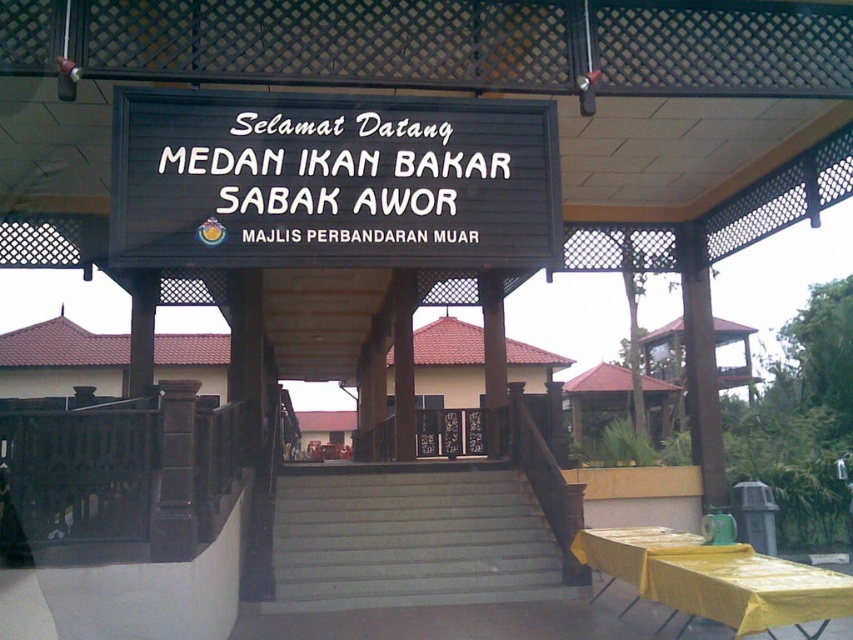
Question: Which object is closer to the camera taking this photo?

Choices:
 (A) black wood sign at center
 (B) yellow plastic table at lower right

Answer: (A)

Question: Is gray concrete stairs at center in front of yellow plastic table at lower right?

Choices:
 (A) yes
 (B) no

Answer: (B)

Question: Which point is farther from the camera taking this photo?

Choices:
 (A) (248, 204)
 (B) (704, 564)
 (C) (323, 579)

Answer: (C)

Question: Which object appears closest to the camera in this image?

Choices:
 (A) yellow plastic table at lower right
 (B) black wood sign at center

Answer: (B)

Question: Is black wood sign at center wider than gray concrete stairs at center?

Choices:
 (A) yes
 (B) no

Answer: (B)

Question: Does black wood sign at center have a larger size compared to yellow plastic table at lower right?

Choices:
 (A) yes
 (B) no

Answer: (B)